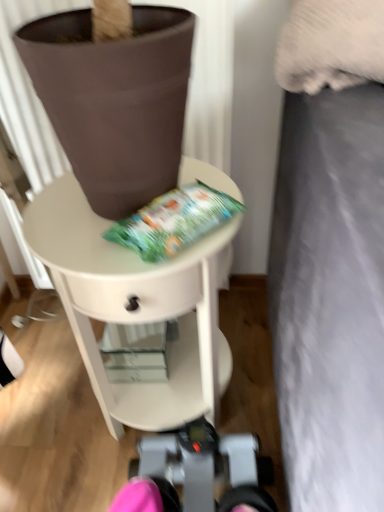
Find the location of a particular element. free space above white glossy table at center (from a real-world perspective) is located at coordinates (95, 227).